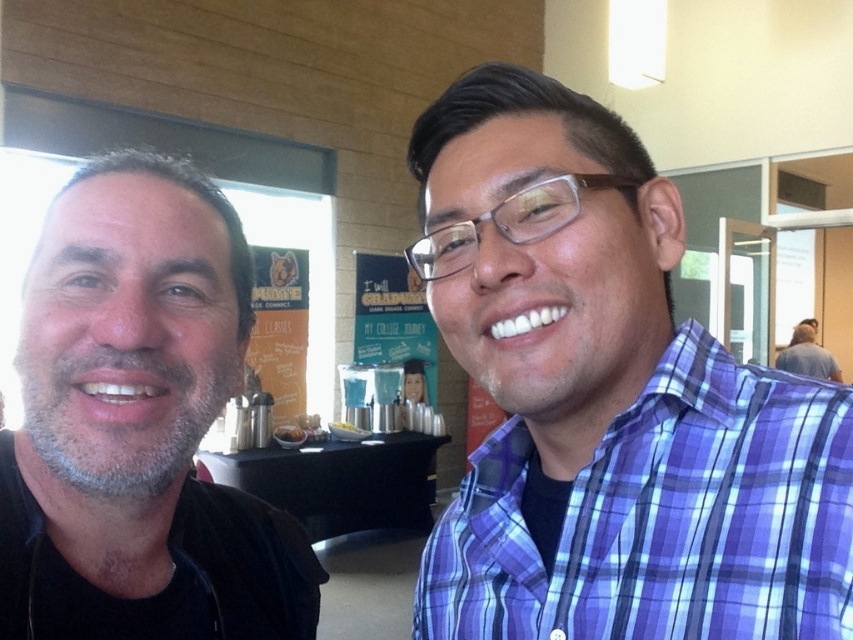
From the picture: You are a photographer setting up for a group photo. You need to position two subjects so that they are exactly 10 feet apart. The black matte shirt at left and black glossy table at center are currently 11.13 feet apart. Can they move closer to meet the requirement?

The black matte shirt at left and black glossy table at center are currently 11.13 feet apart. To meet the 10 feet requirement, they need to move 1.13 feet closer to each other.